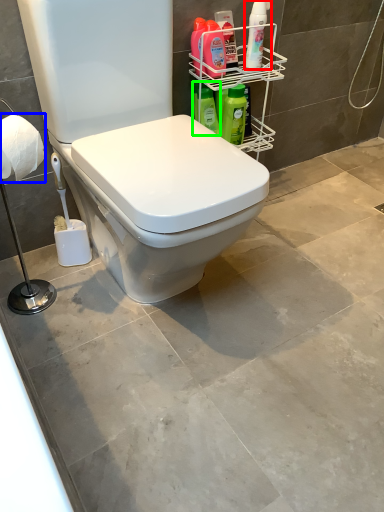
Question: Which object is the farthest from cleaning product (highlighted by a red box)? Choose among these: toilet paper (highlighted by a blue box) or cleaning product (highlighted by a green box).

Choices:
 (A) toilet paper
 (B) cleaning product

Answer: (A)